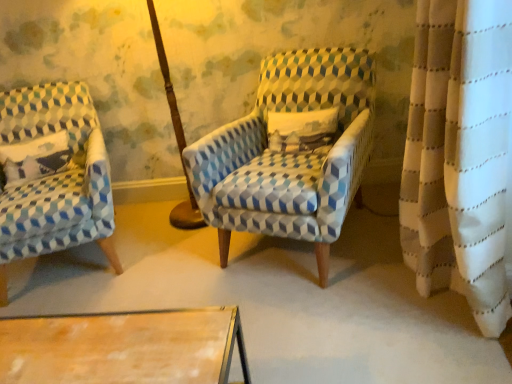
Question: Would you consider blue and white patterned armchair at center, the second chair from the left, to be distant from white cotton pillow at left?

Choices:
 (A) no
 (B) yes

Answer: (B)

Question: From a real-world perspective, is blue and white patterned armchair at center, the second chair from the left, beneath white cotton pillow at left?

Choices:
 (A) yes
 (B) no

Answer: (A)

Question: Does blue and white patterned armchair at center, the first chair from the right, have a lesser height compared to white cotton pillow at left?

Choices:
 (A) yes
 (B) no

Answer: (B)

Question: Is blue and white patterned armchair at center, the first chair from the right, next to white cotton pillow at left?

Choices:
 (A) yes
 (B) no

Answer: (B)

Question: Is white cotton pillow at left at the back of blue and white patterned armchair at center, the second chair from the left?

Choices:
 (A) no
 (B) yes

Answer: (A)

Question: From the image's perspective, is blue and white patterned armchair at center, the first chair from the right, located beneath white cotton pillow at left?

Choices:
 (A) no
 (B) yes

Answer: (B)

Question: From a real-world perspective, is white cotton pillow at left located higher than blue and white geometric-patterned armchair at left, arranged as the first chair when viewed from the left?

Choices:
 (A) no
 (B) yes

Answer: (B)

Question: Is white cotton pillow at left facing towards blue and white geometric-patterned armchair at left, arranged as the first chair when viewed from the left?

Choices:
 (A) yes
 (B) no

Answer: (A)

Question: Considering the relative sizes of white cotton pillow at left and blue and white geometric-patterned armchair at left, positioned as the second chair in right-to-left order, in the image provided, is white cotton pillow at left shorter than blue and white geometric-patterned armchair at left, positioned as the second chair in right-to-left order,?

Choices:
 (A) no
 (B) yes

Answer: (B)

Question: Can you confirm if white cotton pillow at left is smaller than blue and white geometric-patterned armchair at left, arranged as the first chair when viewed from the left?

Choices:
 (A) no
 (B) yes

Answer: (B)

Question: Is blue and white geometric-patterned armchair at left, positioned as the second chair in right-to-left order, located within white cotton pillow at left?

Choices:
 (A) no
 (B) yes

Answer: (A)

Question: Is white cotton pillow at left thinner than blue and white geometric-patterned armchair at left, arranged as the first chair when viewed from the left?

Choices:
 (A) no
 (B) yes

Answer: (B)

Question: From a real-world perspective, is white cotton pillow at left on blue and white patterned armchair at center, the second chair from the left?

Choices:
 (A) yes
 (B) no

Answer: (A)